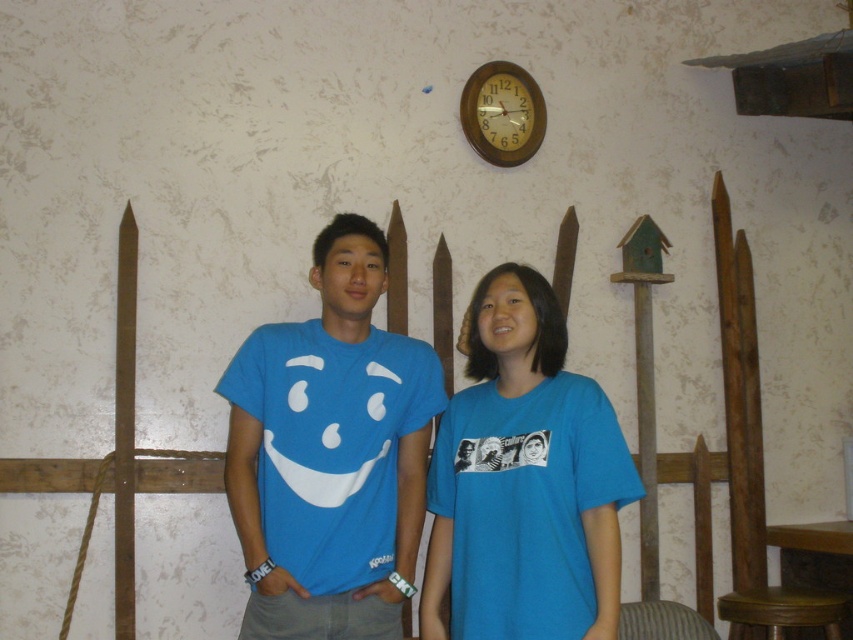
Question: Can you confirm if matte blue t-shirt at center is positioned to the right of wooden clock at upper center?

Choices:
 (A) no
 (B) yes

Answer: (A)

Question: Estimate the real-world distances between objects in this image. Which object is closer to the matte blue t-shirt at center?

Choices:
 (A) blue cotton shirt at center
 (B) brown wooden stool at lower right
 (C) wooden clock at upper center

Answer: (A)

Question: Based on their relative distances, which object is nearer to the blue cotton shirt at center?

Choices:
 (A) brown wooden stool at lower right
 (B) wooden clock at upper center
 (C) matte blue t-shirt at center

Answer: (C)

Question: Can you confirm if matte blue t-shirt at center is positioned to the right of blue cotton shirt at center?

Choices:
 (A) yes
 (B) no

Answer: (B)

Question: Which of the following is the farthest from the observer?

Choices:
 (A) wooden clock at upper center
 (B) blue cotton shirt at center
 (C) matte blue t-shirt at center

Answer: (A)

Question: Is matte blue t-shirt at center below brown wooden stool at lower right?

Choices:
 (A) yes
 (B) no

Answer: (B)